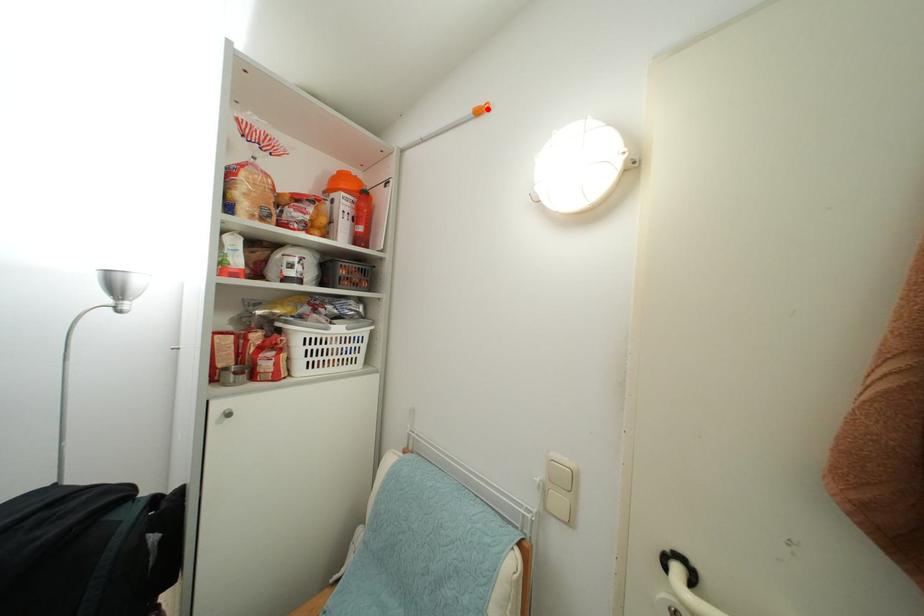
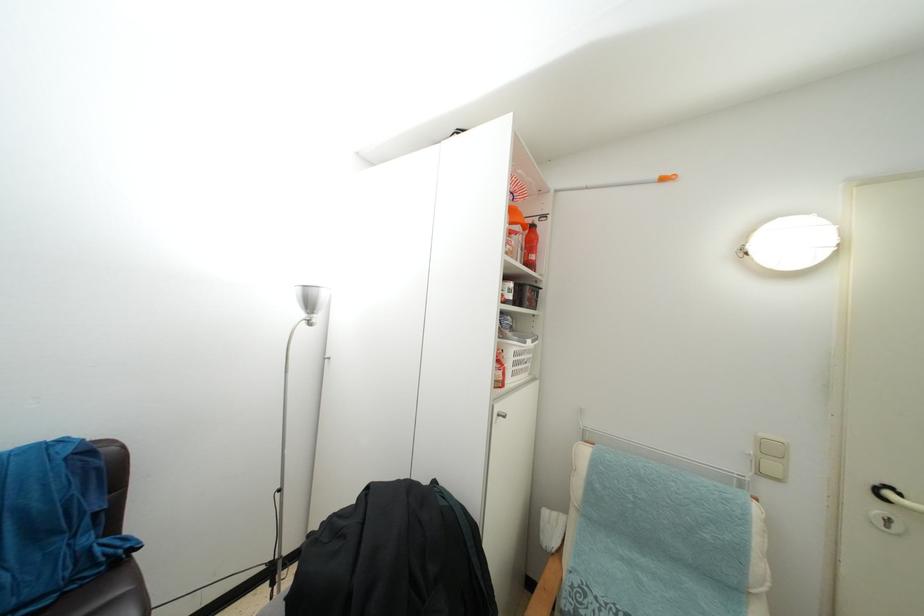
Locate, in the second image, the point that corresponds to the highlighted location in the first image.

(674, 180)